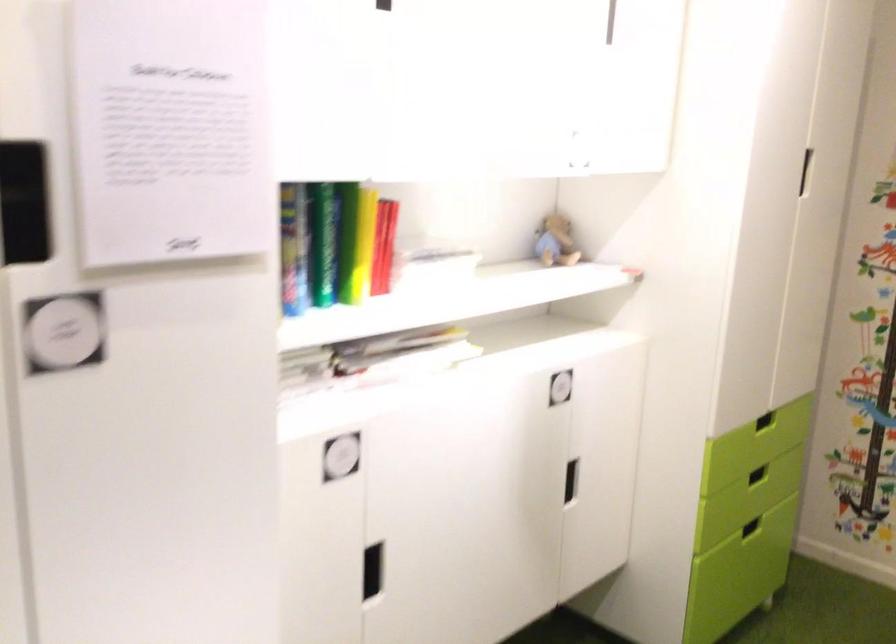
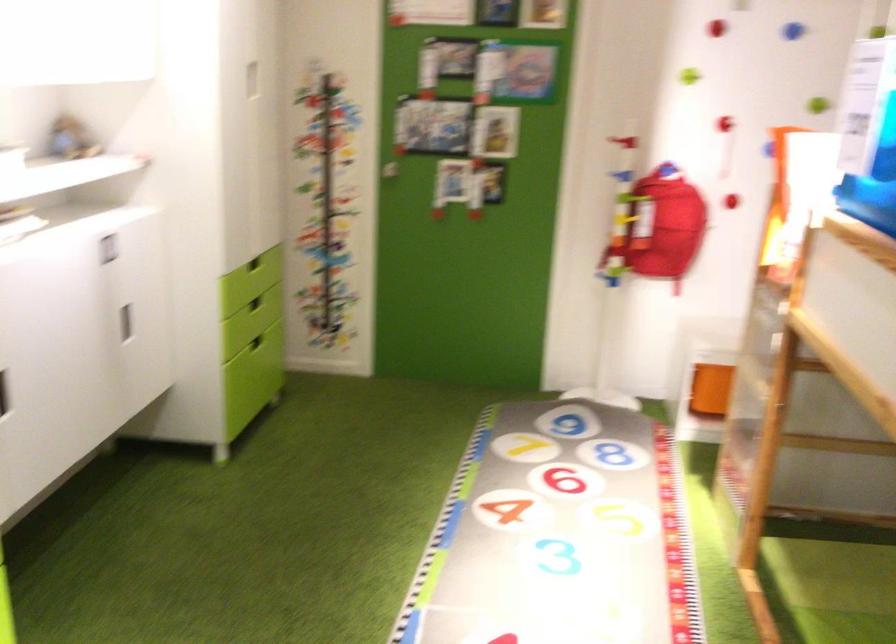
Question: The images are taken continuously from a first-person perspective. In which direction is your viewpoint rotating?

Choices:
 (A) Left
 (B) Right
 (C) Up
 (D) Down

Answer: (B)